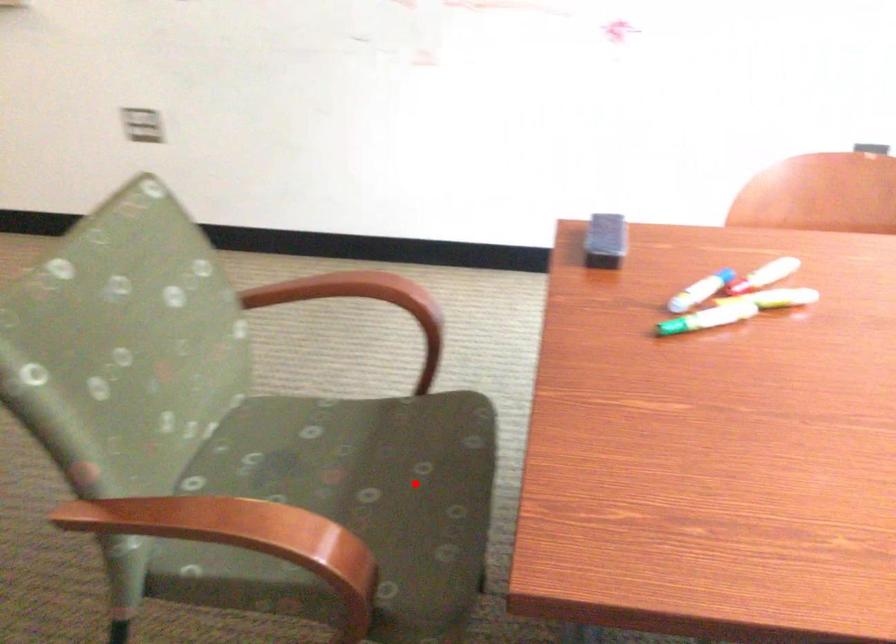
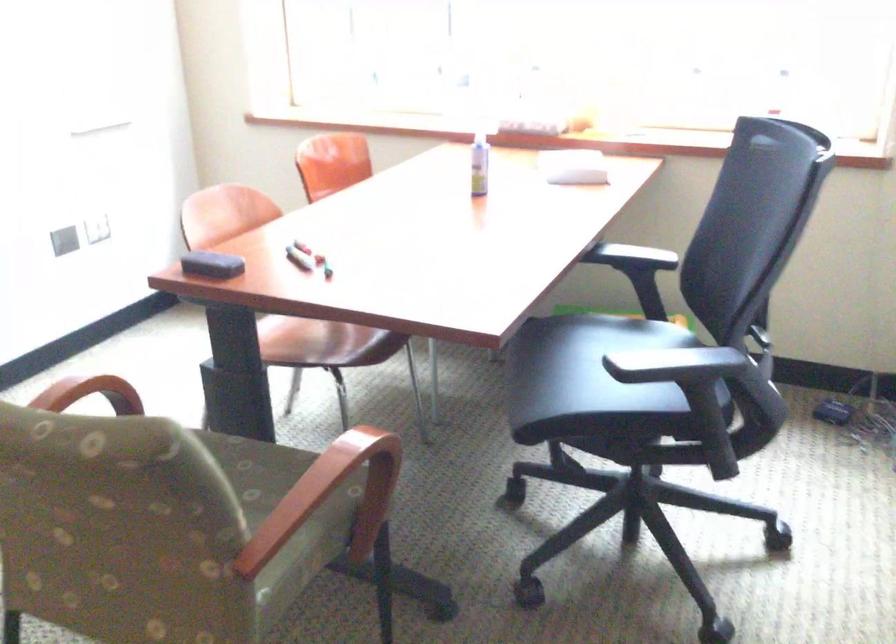
Question: I am providing you with two images of the same scene from different viewpoints. A red point is shown in image1. For the corresponding object point in image2, is it positioned nearer or farther from the camera?

Choices:
 (A) Nearer
 (B) Farther

Answer: (B)